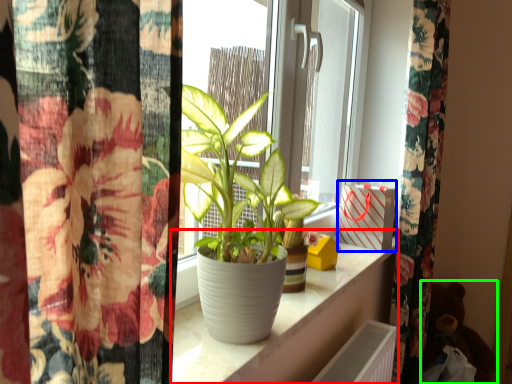
Question: Considering the real-world distances, which object is farthest from window sill (highlighted by a red box)? window box (highlighted by a blue box) or toy (highlighted by a green box)?

Choices:
 (A) window box
 (B) toy

Answer: (B)